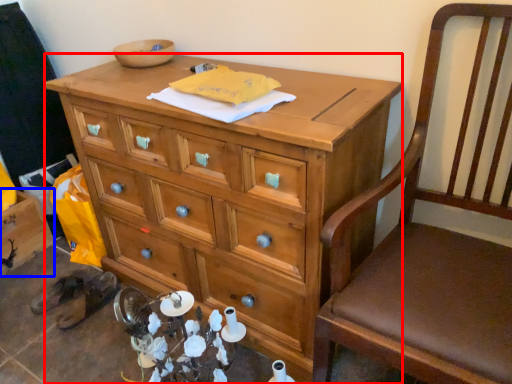
Question: Which point is further to the camera, desk (highlighted by a red box) or cabinetry (highlighted by a blue box)?

Choices:
 (A) desk
 (B) cabinetry

Answer: (B)